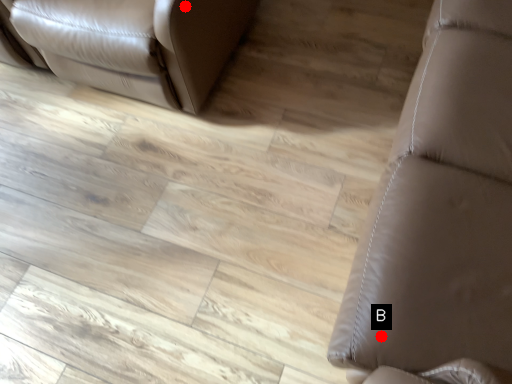
Question: Two points are circled on the image, labeled by A and B beside each circle. Which point is closer to the camera taking this photo?

Choices:
 (A) A is closer
 (B) B is closer

Answer: (B)